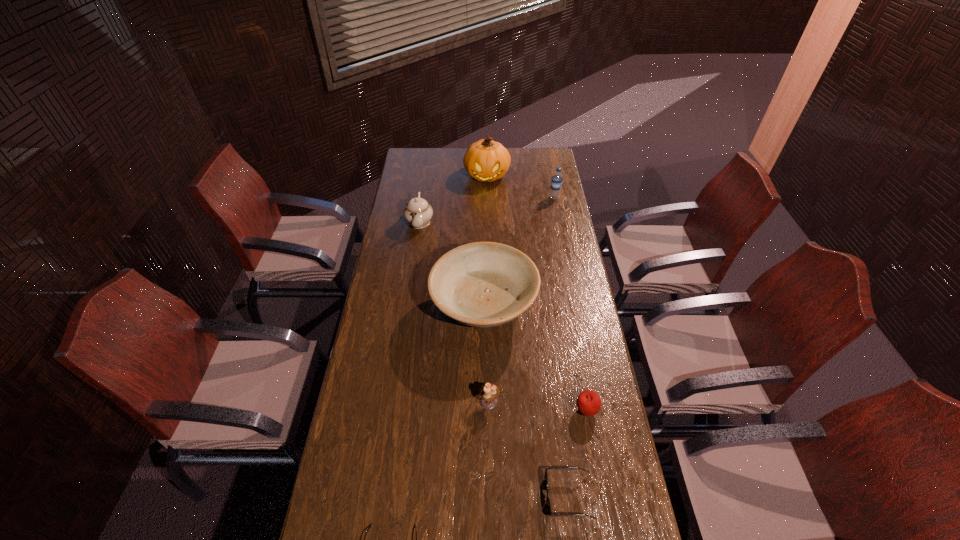
Where is `free space located on the label of the water bottle`? This screenshot has height=540, width=960. free space located on the label of the water bottle is located at coordinates (493, 197).

Locate an element on the screen. free region located 0.110m on the label of the water bottle is located at coordinates (527, 197).

Where is `free space located on the label of the water bottle`? free space located on the label of the water bottle is located at coordinates (539, 197).

Locate an element on the screen. The height and width of the screenshot is (540, 960). vacant space located 0.360m at the spout of the chinaware is located at coordinates (409, 295).

Identify the location of vacant point located 0.110m on the right of the candle holder. This screenshot has height=540, width=960. (533, 401).

I want to click on vacant region located 0.220m on the back of the third shortest object, so click(x=574, y=343).

You are a GUI agent. You are given a task and a screenshot of the screen. Output one action in this format:
    pyautogui.click(x=<x>, y=<y>)
    Task: Click on the vacant space located 0.050m at the front lenses of the sunglasses
    The width and height of the screenshot is (960, 540).
    Given the screenshot: What is the action you would take?
    (528, 496)

Locate an element on the screen. The height and width of the screenshot is (540, 960). vacant space situated at the front lenses of the sunglasses is located at coordinates (481, 496).

Where is `free space located 0.150m at the front lenses of the sunglasses`? free space located 0.150m at the front lenses of the sunglasses is located at coordinates (492, 496).

Where is `object that is at the far edge`? This screenshot has height=540, width=960. object that is at the far edge is located at coordinates (485, 160).